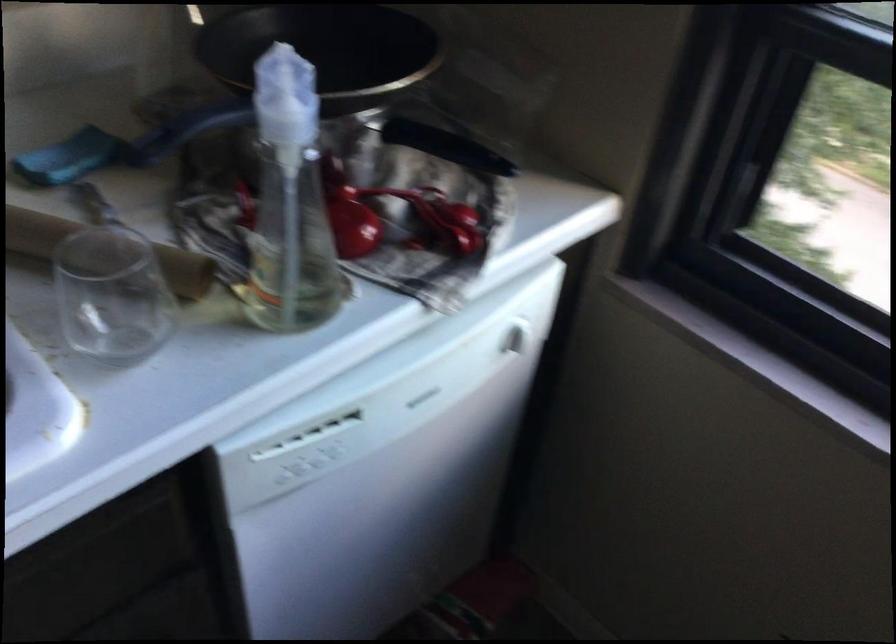
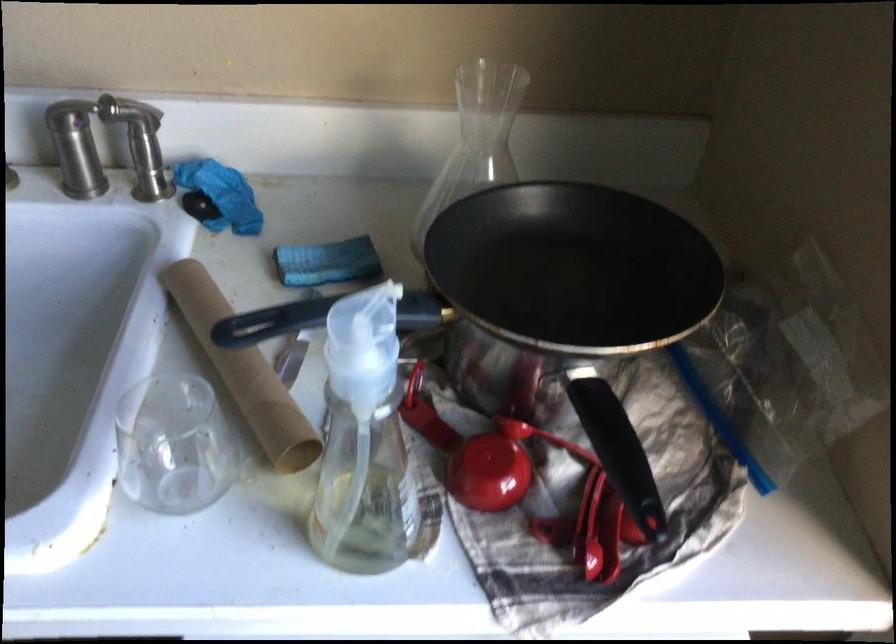
The point at (367, 216) is marked in the first image. Where is the corresponding point in the second image?

(512, 469)